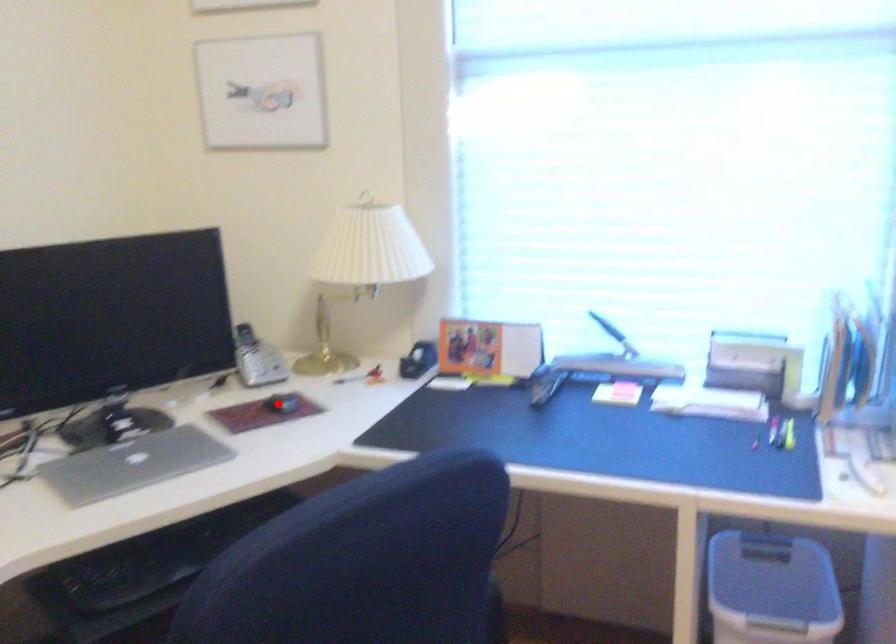
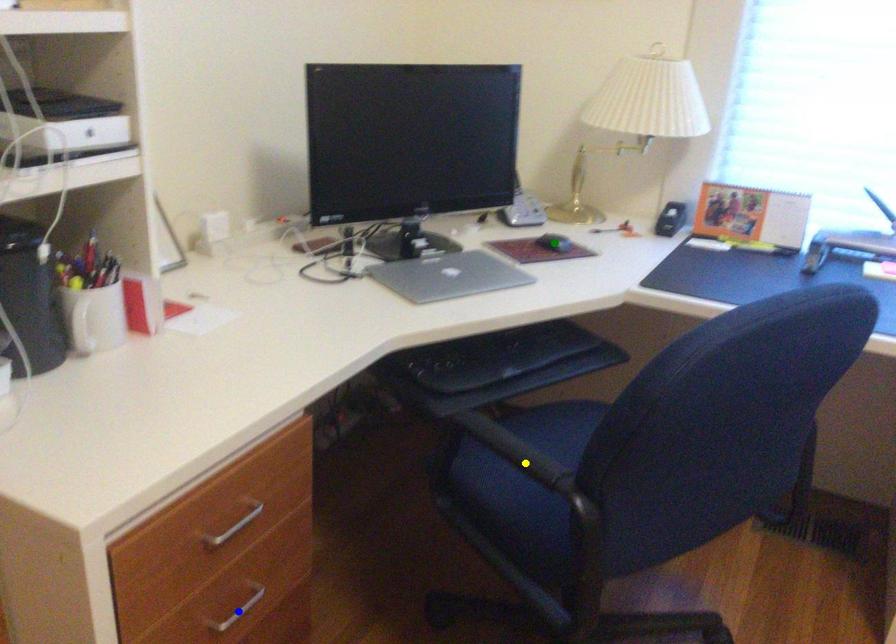
Question: I am providing you with two images of the same scene from different viewpoints. A red point is marked on the first image. You are given multiple points on the second image. Which mark in image 2 goes with the point in image 1?

Choices:
 (A) green point
 (B) yellow point
 (C) blue point

Answer: (A)